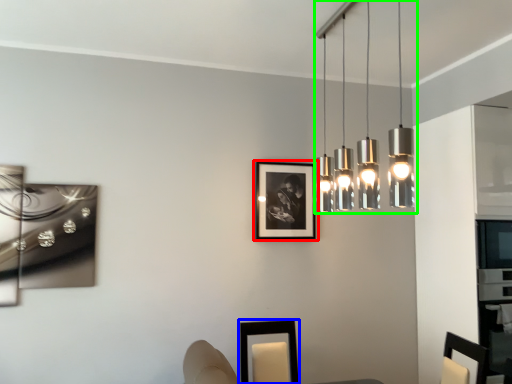
Question: Considering the real-world distances, which object is closest to picture frame (highlighted by a red box)? picture frame (highlighted by a blue box) or lamp (highlighted by a green box).

Choices:
 (A) picture frame
 (B) lamp

Answer: (A)